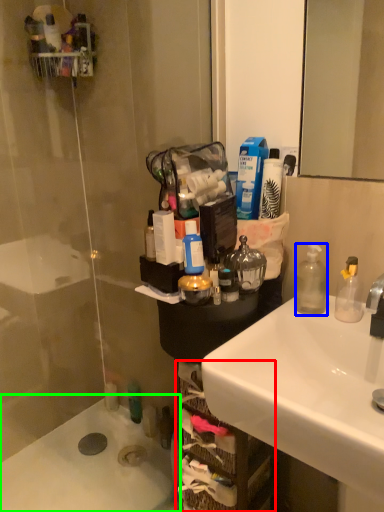
Question: Which is nearer to the shelf (highlighted by a red box)? bottle (highlighted by a blue box) or bath (highlighted by a green box).

Choices:
 (A) bottle
 (B) bath

Answer: (A)